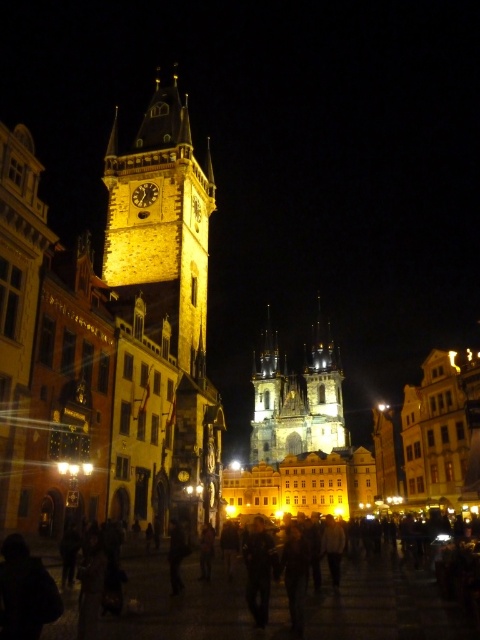
You are a tourist standing in the town square looking towards the clock tower. You notice the dark clothing crowd at center and the golden stone cathedral at center. Which object is taller?

The golden stone cathedral at center is taller than the dark clothing crowd at center.

You are standing at the center of the town square and want to take a photo of the clock tower without anyone in the frame. Is the dark clothing crowd at center blocking your view of the clock tower?

The dark clothing crowd at center is located at point (191, 604), which is directly in front of the clock tower. Therefore, the crowd is blocking your view of the clock tower.